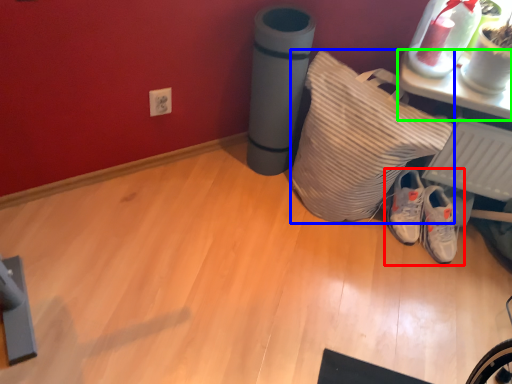
Question: Estimate the real-world distances between objects in this image. Which object is closer to footwear (highlighted by a red box), pillow (highlighted by a blue box) or furniture (highlighted by a green box)?

Choices:
 (A) pillow
 (B) furniture

Answer: (A)